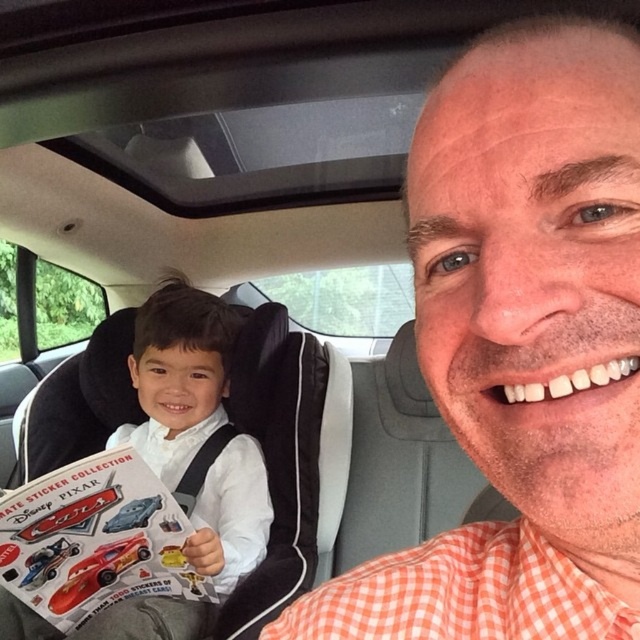
Question: Which point appears farthest from the camera in this image?

Choices:
 (A) (76, 586)
 (B) (195, 310)
 (C) (360, 602)

Answer: (B)

Question: Is orange checkered shirt at center below shiny red toy car at center?

Choices:
 (A) yes
 (B) no

Answer: (B)

Question: Is orange checkered shirt at center further to camera compared to shiny red toy car at center?

Choices:
 (A) no
 (B) yes

Answer: (A)

Question: Among these points, which one is nearest to the camera?

Choices:
 (A) (504, 150)
 (B) (208, 355)
 (C) (93, 579)

Answer: (A)

Question: Which of the following is the farthest from the observer?

Choices:
 (A) orange checkered shirt at center
 (B) white smooth shirt at center

Answer: (B)

Question: Can you confirm if orange checkered shirt at center is smaller than white smooth shirt at center?

Choices:
 (A) yes
 (B) no

Answer: (A)